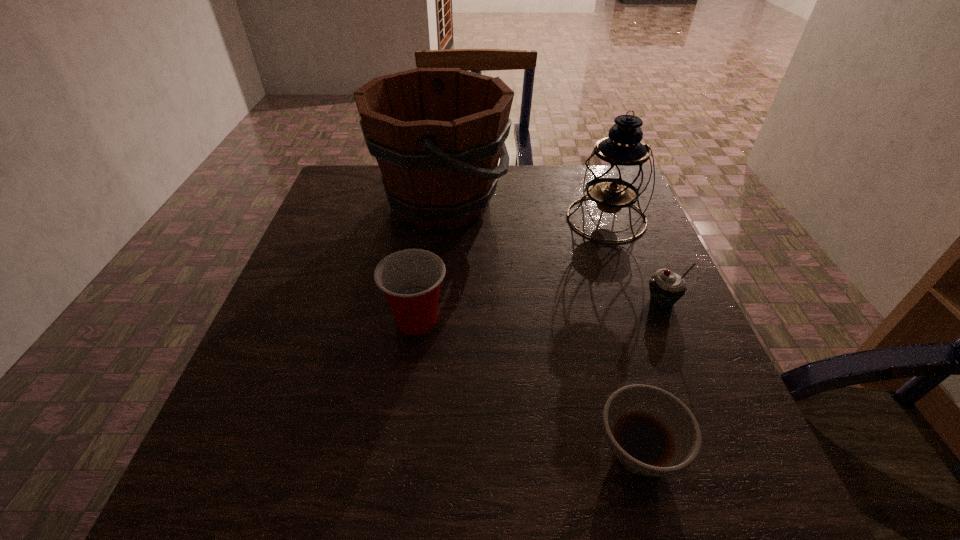
I want to click on object positioned at the near right corner, so click(x=651, y=432).

This screenshot has height=540, width=960. I want to click on free space at the near edge of the desktop, so click(597, 476).

At what (x,y) coordinates should I click in order to perform the action: click on blank space at the left edge of the desktop. Please return your answer as a coordinate pair (x, y). Image resolution: width=960 pixels, height=540 pixels. Looking at the image, I should click on (352, 287).

In order to click on vacant space at the right edge of the desktop in this screenshot , I will do `click(624, 305)`.

Find the location of a particular element. free space at the far left corner of the desktop is located at coordinates (378, 206).

Where is `vacant region at the near left corner of the desktop`? The width and height of the screenshot is (960, 540). vacant region at the near left corner of the desktop is located at coordinates (225, 476).

Find the location of a particular element. The width and height of the screenshot is (960, 540). vacant space at the far right corner is located at coordinates (585, 187).

In the image, there is a desktop. Identify the location of vacant space at the near right corner. The height and width of the screenshot is (540, 960). (727, 499).

The image size is (960, 540). I want to click on free space between the second shortest object and the shortest object, so click(650, 376).

Where is `free point between the cup and the soup bowl`? The width and height of the screenshot is (960, 540). free point between the cup and the soup bowl is located at coordinates pyautogui.click(x=528, y=386).